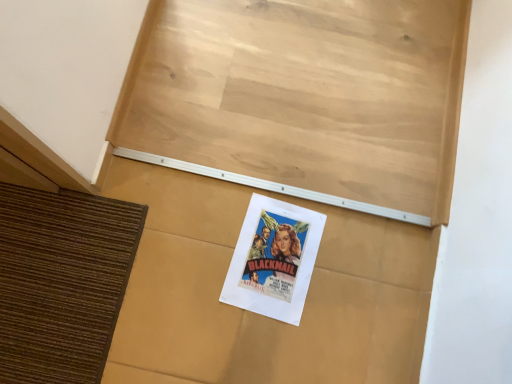
Question: Are matte paper poster at center and white paper poster at center located far from each other?

Choices:
 (A) yes
 (B) no

Answer: (B)

Question: From a real-world perspective, is matte paper poster at center on white paper poster at center?

Choices:
 (A) yes
 (B) no

Answer: (B)

Question: Can you confirm if matte paper poster at center is taller than white paper poster at center?

Choices:
 (A) yes
 (B) no

Answer: (B)

Question: From the image's perspective, is matte paper poster at center beneath white paper poster at center?

Choices:
 (A) yes
 (B) no

Answer: (A)

Question: Can you confirm if matte paper poster at center is bigger than white paper poster at center?

Choices:
 (A) yes
 (B) no

Answer: (B)

Question: Considering the relative sizes of matte paper poster at center and white paper poster at center in the image provided, is matte paper poster at center shorter than white paper poster at center?

Choices:
 (A) no
 (B) yes

Answer: (B)

Question: Considering the relative sizes of white paper poster at center and matte paper poster at center in the image provided, is white paper poster at center wider than matte paper poster at center?

Choices:
 (A) no
 (B) yes

Answer: (A)

Question: From a real-world perspective, is white paper poster at center physically below matte paper poster at center?

Choices:
 (A) no
 (B) yes

Answer: (A)

Question: From the image's perspective, would you say white paper poster at center is positioned over matte paper poster at center?

Choices:
 (A) yes
 (B) no

Answer: (A)

Question: Is white paper poster at center far away from matte paper poster at center?

Choices:
 (A) yes
 (B) no

Answer: (B)

Question: From a real-world perspective, is white paper poster at center on matte paper poster at center?

Choices:
 (A) yes
 (B) no

Answer: (A)

Question: Considering the relative sizes of white paper poster at center and matte paper poster at center in the image provided, is white paper poster at center taller than matte paper poster at center?

Choices:
 (A) yes
 (B) no

Answer: (A)

Question: In terms of height, does matte paper poster at center look taller or shorter compared to white paper poster at center?

Choices:
 (A) short
 (B) tall

Answer: (A)